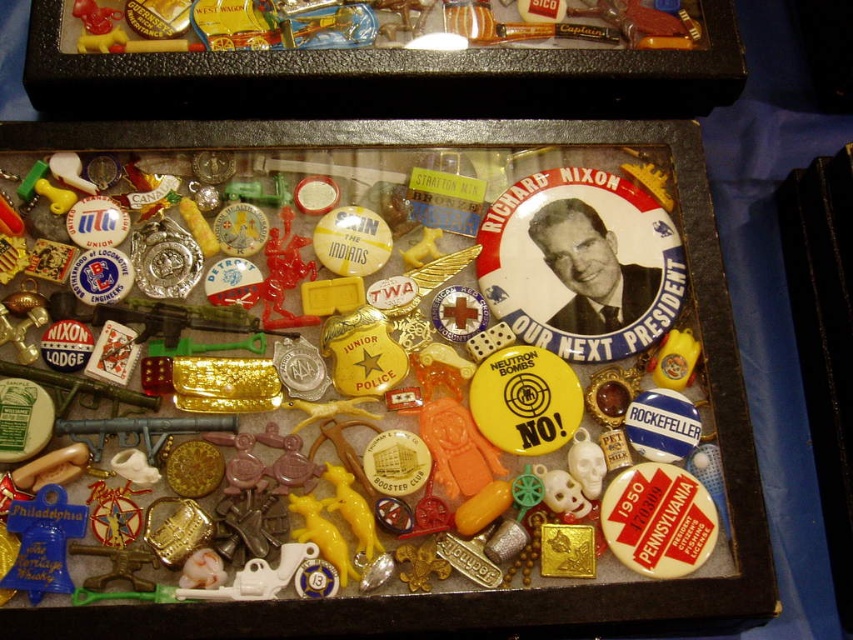
Question: Can you confirm if clear plastic box at center is positioned to the right of matte plastic playing card at center-left?

Choices:
 (A) no
 (B) yes

Answer: (B)

Question: Where is clear plastic box at center located in relation to matte plastic playing card at center-left in the image?

Choices:
 (A) above
 (B) below

Answer: (B)

Question: Which object appears farthest from the camera in this image?

Choices:
 (A) matte plastic playing card at center-left
 (B) clear plastic box at center

Answer: (A)

Question: Which of the following is the closest to the observer?

Choices:
 (A) (648, 136)
 (B) (137, 352)

Answer: (B)

Question: Is clear plastic box at center to the right of matte plastic playing card at center-left from the viewer's perspective?

Choices:
 (A) yes
 (B) no

Answer: (A)